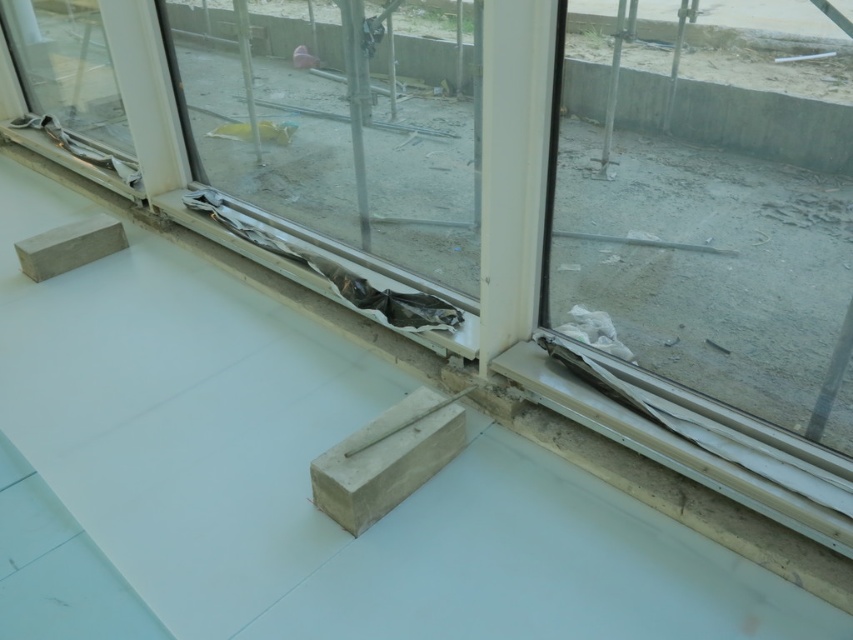
Question: Which point is closer to the camera?

Choices:
 (A) (711, 60)
 (B) (431, 236)

Answer: (B)

Question: Does transparent glass door at right come behind transparent plastic glass door at center?

Choices:
 (A) yes
 (B) no

Answer: (B)

Question: Which point appears farthest from the camera in this image?

Choices:
 (A) (746, 252)
 (B) (312, 113)

Answer: (B)

Question: Which object appears farthest from the camera in this image?

Choices:
 (A) transparent plastic glass door at center
 (B) transparent glass door at right

Answer: (A)

Question: Does transparent glass door at right have a lesser width compared to transparent plastic glass door at center?

Choices:
 (A) no
 (B) yes

Answer: (B)

Question: Is transparent glass door at right closer to the viewer compared to transparent plastic glass door at center?

Choices:
 (A) yes
 (B) no

Answer: (A)